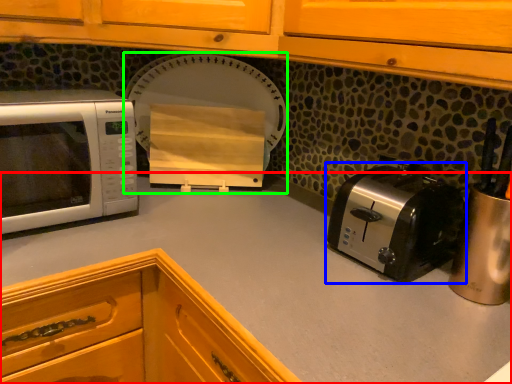
Question: Which object is positioned closest to countertop (highlighted by a red box)? Select from toaster (highlighted by a blue box) and appliance (highlighted by a green box).

Choices:
 (A) toaster
 (B) appliance

Answer: (A)